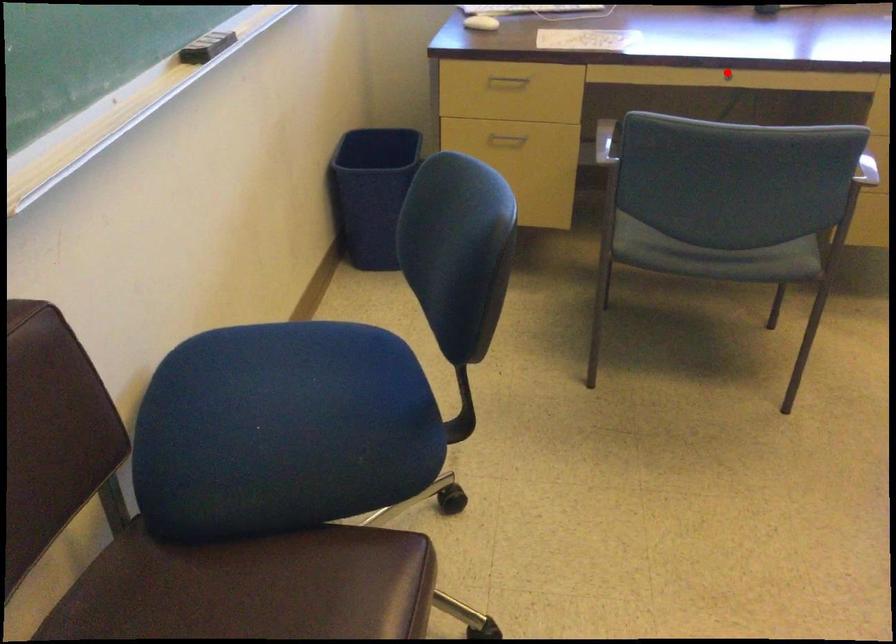
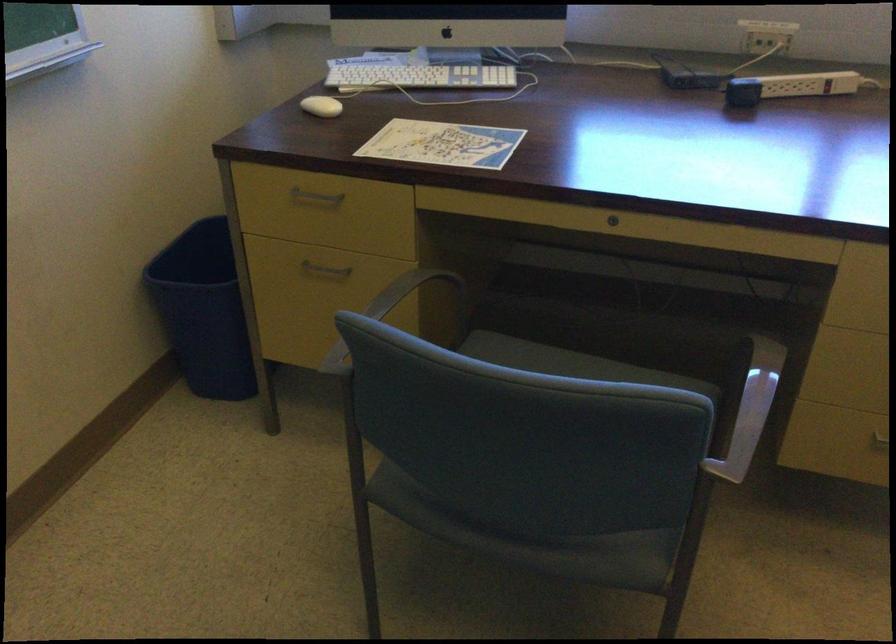
Question: A red point is marked in image1. In image2, is the corresponding 3D point closer to the camera or farther? Reply with the corresponding letter.

Choices:
 (A) The corresponding 3D point is closer.
 (B) The corresponding 3D point is farther.

Answer: (A)